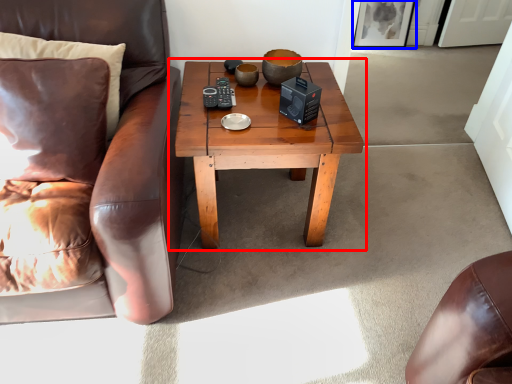
Question: Which object appears closest to the camera in this image, coffee table (highlighted by a red box) or picture frame (highlighted by a blue box)?

Choices:
 (A) coffee table
 (B) picture frame

Answer: (A)